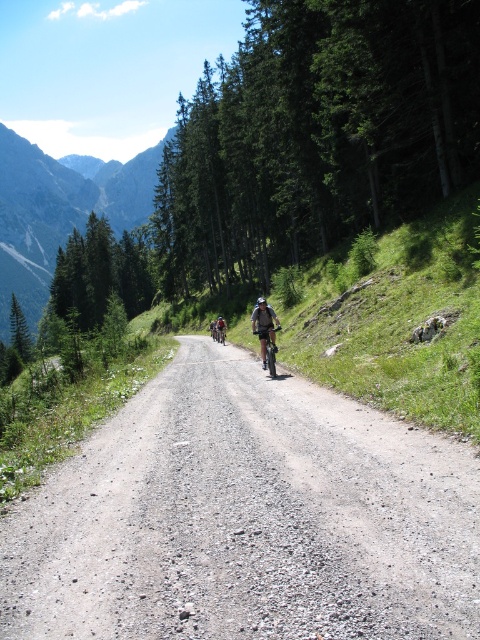
Question: Which is farther from the dusty gravel road at center?

Choices:
 (A) green forested mountain at upper left
 (B) gray fabric helmet at center

Answer: (A)

Question: Can you confirm if dusty gravel road at center is wider than green forested mountain at upper left?

Choices:
 (A) yes
 (B) no

Answer: (B)

Question: Observing the image, what is the correct spatial positioning of dusty gravel road at center in reference to gray fabric helmet at center?

Choices:
 (A) above
 (B) below

Answer: (B)

Question: Which point appears farthest from the camera in this image?

Choices:
 (A) (83, 196)
 (B) (266, 323)
 (C) (62, 493)

Answer: (A)

Question: Which is farther from the green forested mountain at upper left?

Choices:
 (A) dusty gravel road at center
 (B) gray fabric helmet at center

Answer: (B)

Question: In this image, where is dusty gravel road at center located relative to green forested mountain at upper left?

Choices:
 (A) below
 (B) above

Answer: (A)